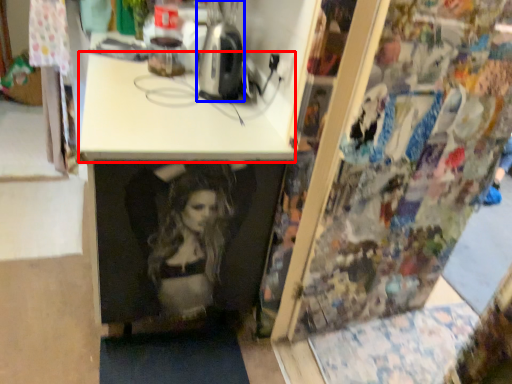
Question: Which object is further to the camera taking this photo, counter top (highlighted by a red box) or appliance (highlighted by a blue box)?

Choices:
 (A) counter top
 (B) appliance

Answer: (B)